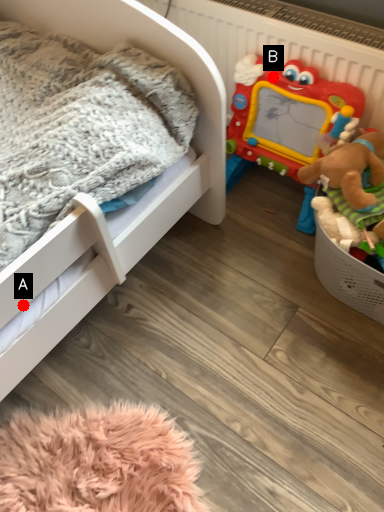
Question: Two points are circled on the image, labeled by A and B beside each circle. Which point is farther from the camera taking this photo?

Choices:
 (A) A is further
 (B) B is further

Answer: (B)